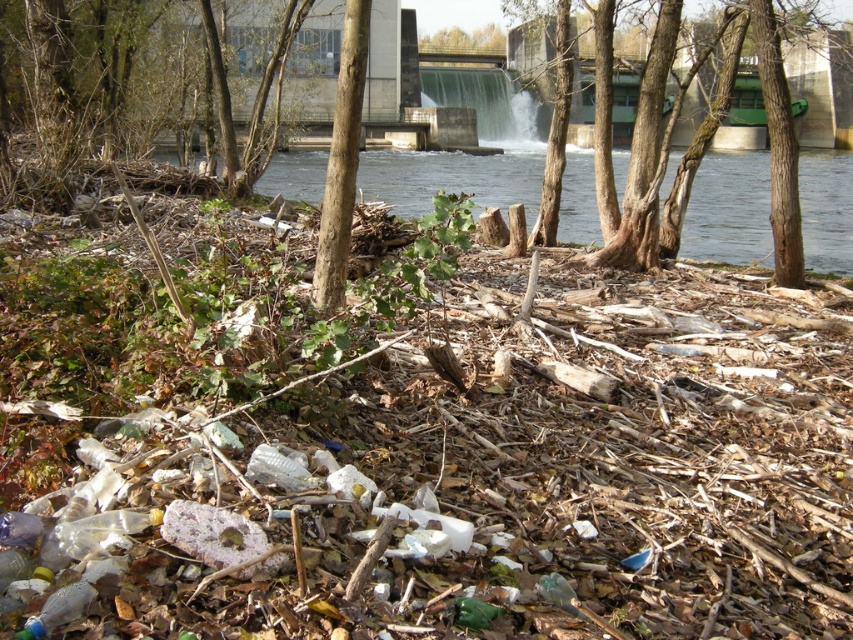
Question: Estimate the real-world distances between objects in this image. Which object is farther from the brown wood tree at upper center?

Choices:
 (A) green leafy tree at upper center
 (B) smooth bark tree at center

Answer: (A)

Question: Which object is farther from the camera taking this photo?

Choices:
 (A) brown wood tree at upper center
 (B) green leafy tree at upper center

Answer: (B)

Question: Does brown wood tree at upper center have a larger size compared to green leafy tree at upper center?

Choices:
 (A) yes
 (B) no

Answer: (A)

Question: Can you confirm if brown wood tree at upper center is smaller than green leafy tree at upper center?

Choices:
 (A) yes
 (B) no

Answer: (B)

Question: Is smooth bark tree at center above green leafy tree at upper center?

Choices:
 (A) yes
 (B) no

Answer: (B)

Question: Which of the following is the farthest from the observer?

Choices:
 (A) (659, 136)
 (B) (318, 1)

Answer: (B)